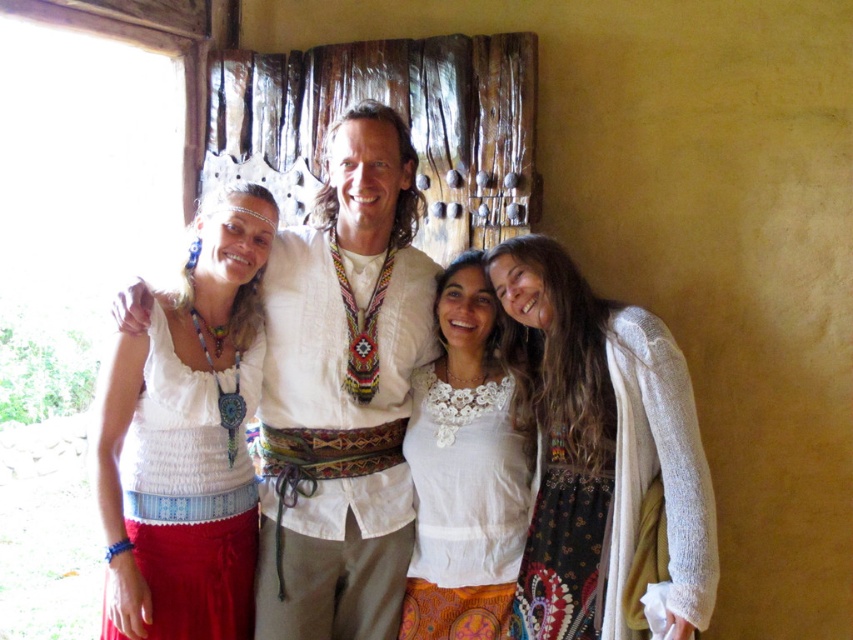
Looking at this image, you are a photographer adjusting the camera focus. You need to ensure both the white woven shirt at center and the white textured sweater at right are in focus. Which one should you focus on first to achieve this?

Since the white woven shirt at center is above the white textured sweater at right, you should focus on the white woven shirt at center first as it is closer to the camera.

You are a photographer setting up for a group photo. You notice the white textured sweater at right and the white cotton top at center. Which clothing item is closer to the camera?

The white textured sweater at right is positioned under the white cotton top at center, meaning it is closer to the camera.

You are standing in the room and want to move from point A to point B. Point A is at coordinate point(531, 385) and point B is at coordinate point(160, 385). Which point is closer to you?

Point(531, 385) is closer to you because it is further to the viewer than point(160, 385).